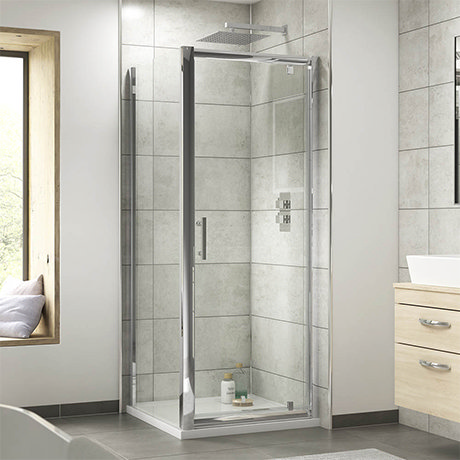
Where is `pillow`? This screenshot has width=460, height=460. pillow is located at coordinates (25, 311).